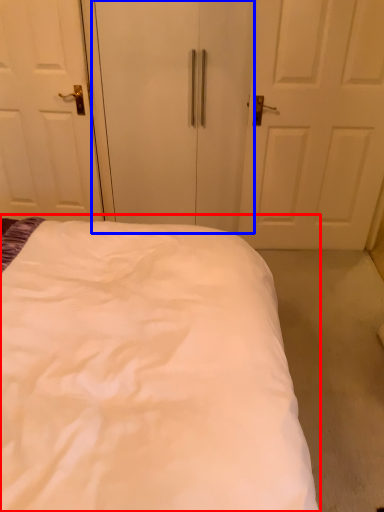
Question: Which object appears closest to the camera in this image, bed (highlighted by a red box) or screen door (highlighted by a blue box)?

Choices:
 (A) bed
 (B) screen door

Answer: (A)